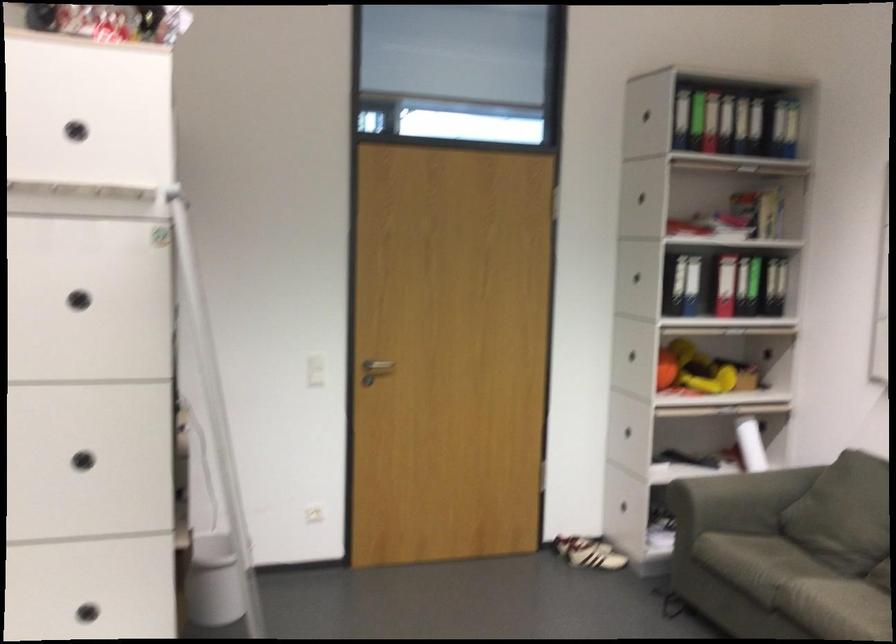
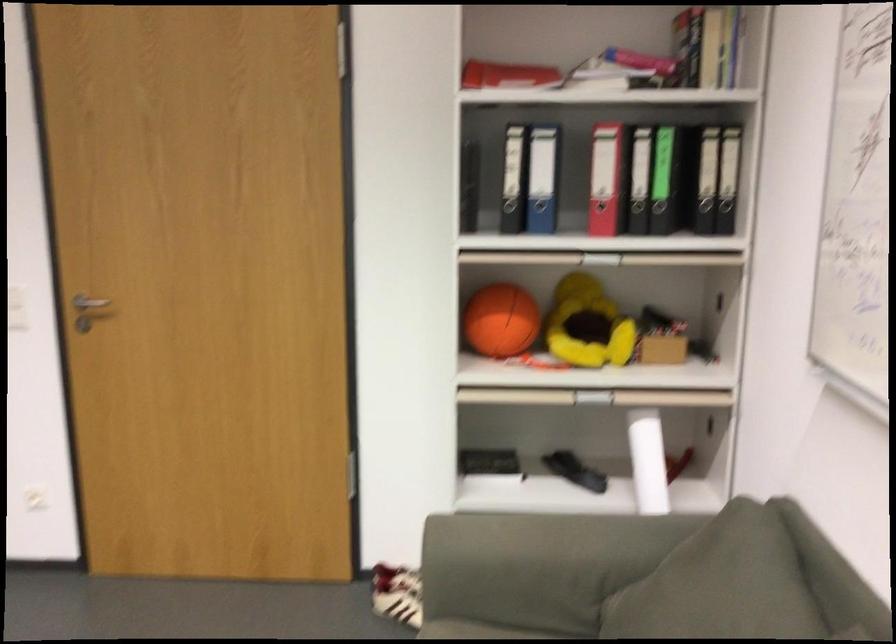
Locate, in the second image, the point that corresponds to [659,360] in the first image.

(501, 321)